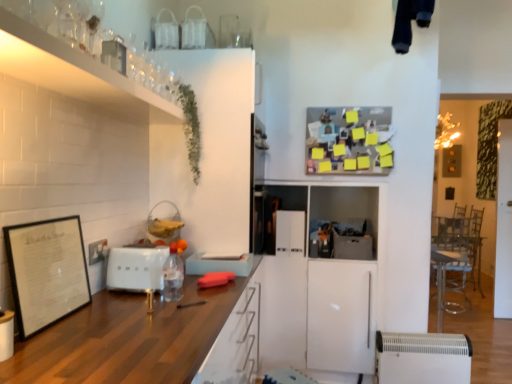
Where is `vacant space situated above black matte picture frame at left (from a real-world perspective)`? Image resolution: width=512 pixels, height=384 pixels. vacant space situated above black matte picture frame at left (from a real-world perspective) is located at coordinates pyautogui.click(x=39, y=216).